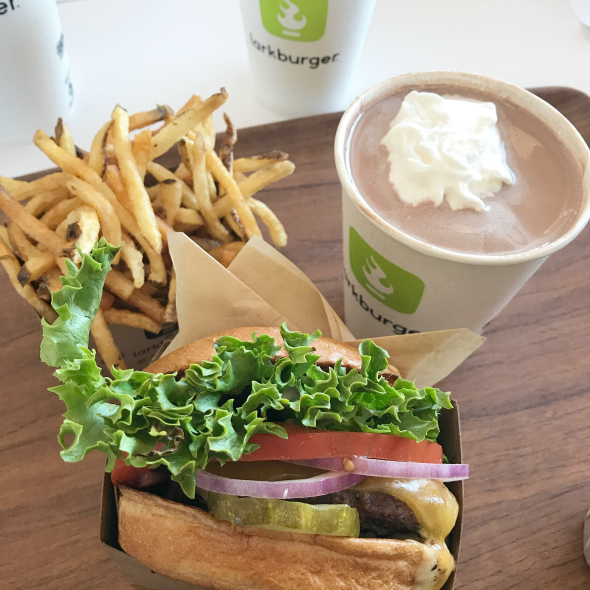
This screenshot has width=590, height=590. Identify the location of brown tray. (537, 368).